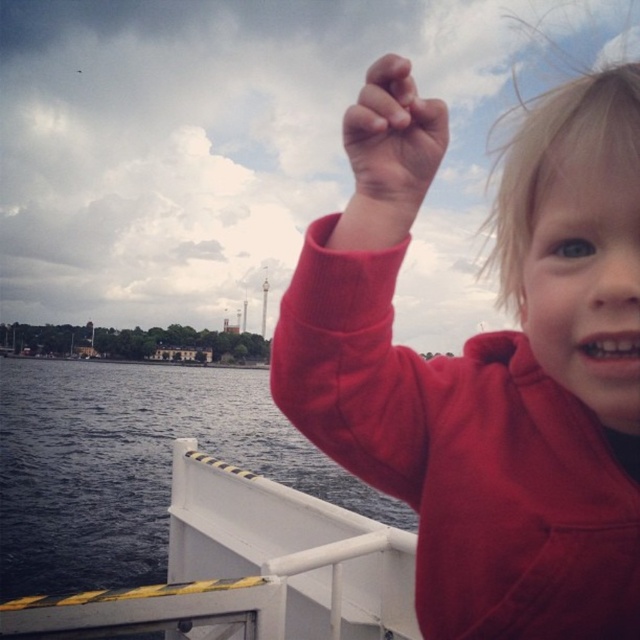
Does red fleece sweater at upper right have a lesser width compared to dark blue water at lower left?

Yes.

Does red fleece sweater at upper right lie in front of dark blue water at lower left?

Yes, red fleece sweater at upper right is in front of dark blue water at lower left.

Between point (528, 129) and point (20, 499), which one is positioned behind?

Point (20, 499)

Where is `red fleece sweater at upper right`? The image size is (640, 640). red fleece sweater at upper right is located at coordinates (488, 364).

Based on the photo, is red fleece sweater at upper right smaller than matte skin hand at upper center?

Indeed, red fleece sweater at upper right has a smaller size compared to matte skin hand at upper center.

Does red fleece sweater at upper right have a lesser height compared to matte skin hand at upper center?

No, red fleece sweater at upper right is not shorter than matte skin hand at upper center.

You are a GUI agent. You are given a task and a screenshot of the screen. Output one action in this format:
    pyautogui.click(x=<x>, y=<y>)
    Task: Click on the red fleece sweater at upper right
    
    Given the screenshot: What is the action you would take?
    pyautogui.click(x=488, y=364)

Is dark blue water at lower left to the right of matte skin hand at upper center from the viewer's perspective?

In fact, dark blue water at lower left is to the left of matte skin hand at upper center.

Who is more forward, (349, 500) or (368, 100)?

Point (368, 100) is more forward.

Does point (12, 410) come farther from viewer compared to point (403, 180)?

Yes, it is.

I want to click on dark blue water at lower left, so click(x=132, y=465).